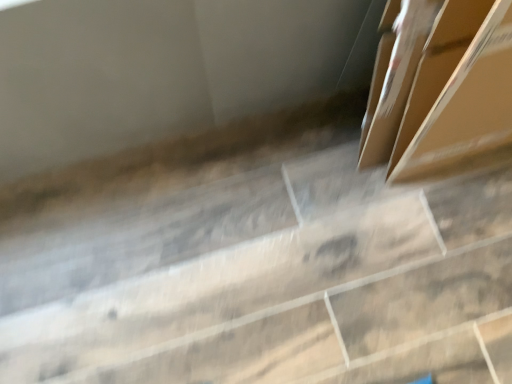
Question: From the image's perspective, is brown cardboard box at center located beneath transparent plastic concrete at center?

Choices:
 (A) yes
 (B) no

Answer: (B)

Question: Can you confirm if brown cardboard box at center is smaller than transparent plastic concrete at center?

Choices:
 (A) no
 (B) yes

Answer: (B)

Question: Can you confirm if brown cardboard box at center is wider than transparent plastic concrete at center?

Choices:
 (A) no
 (B) yes

Answer: (A)

Question: Is brown cardboard box at center positioned beyond the bounds of transparent plastic concrete at center?

Choices:
 (A) yes
 (B) no

Answer: (A)

Question: Is transparent plastic concrete at center a part of brown cardboard box at center?

Choices:
 (A) yes
 (B) no

Answer: (B)

Question: From a real-world perspective, does brown cardboard box at center stand above transparent plastic concrete at center?

Choices:
 (A) yes
 (B) no

Answer: (A)

Question: Can you confirm if transparent plastic concrete at center is shorter than brown cardboard box at center?

Choices:
 (A) yes
 (B) no

Answer: (A)

Question: Does transparent plastic concrete at center have a smaller size compared to brown cardboard box at center?

Choices:
 (A) yes
 (B) no

Answer: (B)

Question: From the image's perspective, is transparent plastic concrete at center above brown cardboard box at center?

Choices:
 (A) no
 (B) yes

Answer: (A)

Question: From a real-world perspective, is transparent plastic concrete at center located higher than brown cardboard box at center?

Choices:
 (A) yes
 (B) no

Answer: (B)

Question: Is transparent plastic concrete at center further to camera compared to brown cardboard box at center?

Choices:
 (A) yes
 (B) no

Answer: (A)

Question: Is transparent plastic concrete at center wider than brown cardboard box at center?

Choices:
 (A) yes
 (B) no

Answer: (A)

Question: In terms of height, does brown cardboard box at center look taller or shorter compared to transparent plastic concrete at center?

Choices:
 (A) short
 (B) tall

Answer: (B)